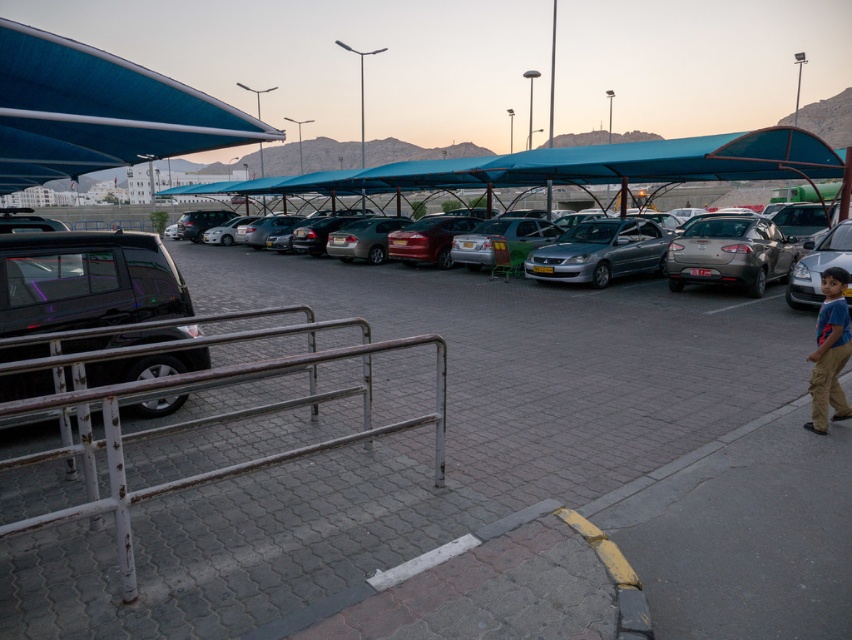
Question: Which point is closer to the camera taking this photo?

Choices:
 (A) (799, 266)
 (B) (787, 262)
 (C) (137, 244)

Answer: (C)

Question: Which of the following is the closest to the observer?

Choices:
 (A) (806, 257)
 (B) (732, 282)
 (C) (818, 273)
 (D) (619, 241)

Answer: (C)

Question: Is the position of rusty metal rail at lower left more distant than that of satin silver sedan at center-right?

Choices:
 (A) yes
 (B) no

Answer: (B)

Question: Does silver metallic sedan at center lie in front of blue cotton shirt at lower right?

Choices:
 (A) no
 (B) yes

Answer: (A)

Question: Which object is the closest to the glossy black car at left?

Choices:
 (A) silver metallic sedan at right
 (B) metallic black car at left
 (C) satin silver sedan at center-right
 (D) blue fabric canopy at upper left

Answer: (B)

Question: Is glossy black car at left to the left of blue cotton shirt at lower right from the viewer's perspective?

Choices:
 (A) no
 (B) yes

Answer: (B)